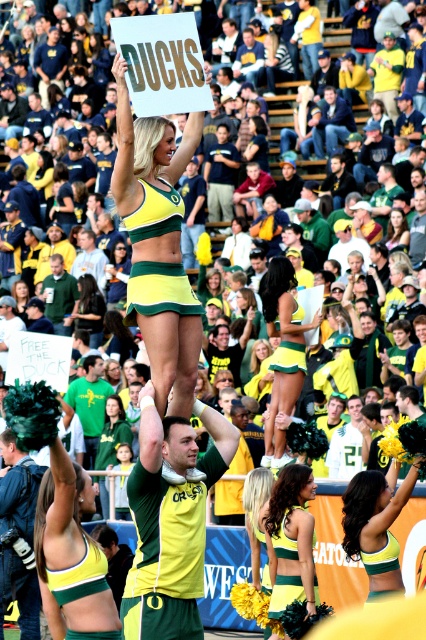
Question: Is matte green pom-pom at center above matte yellow-green cheerleader at center?

Choices:
 (A) yes
 (B) no

Answer: (B)

Question: Does green/yellow fabric cheerleader at center appear under matte green and yellow cheerleader at center?

Choices:
 (A) yes
 (B) no

Answer: (B)

Question: Based on their relative distances, which object is farther from the yellow-green fabric cheerleader at center?

Choices:
 (A) matte green pom-pom at center
 (B) matte yellow-green cheerleader at center
 (C) matte green and yellow cheerleader at center

Answer: (B)

Question: Which point is farther to the camera?

Choices:
 (A) matte green pom-pom at center
 (B) green/yellow fabric cheerleader at center
 (C) matte green and yellow cheerleader at center

Answer: (C)

Question: Does green/yellow fabric cheerleader at center have a smaller size compared to matte yellow-green cheerleader at center?

Choices:
 (A) yes
 (B) no

Answer: (A)

Question: Among these objects, which one is farthest from the camera?

Choices:
 (A) yellow-green fabric cheerleader at center
 (B) matte yellow-green cheerleader at center

Answer: (B)